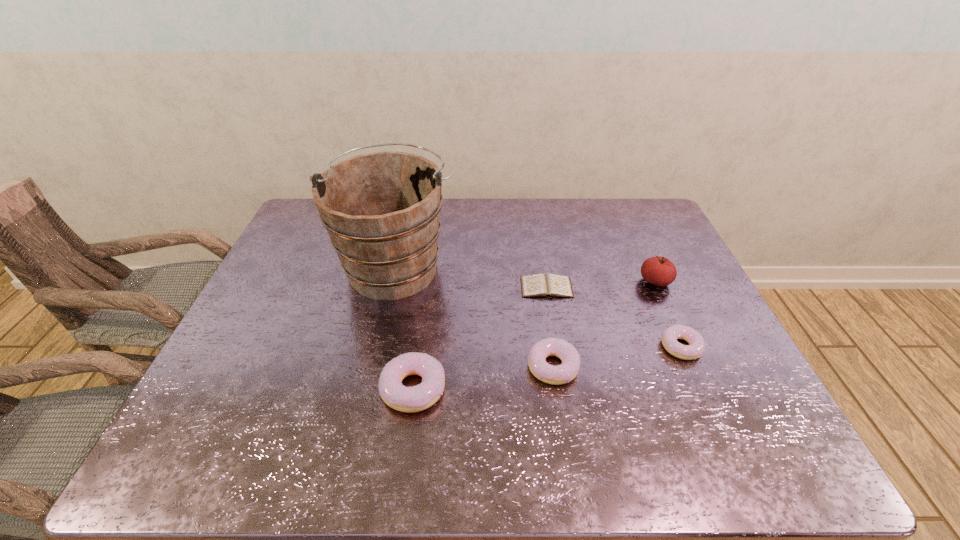
Please point a spot on the left to add another doughnut. Please provide its 2D coordinates. Your answer should be formatted as a tuple, i.e. [(x, y)], where the tuple contains the x and y coordinates of a point satisfying the conditions above.

[(260, 411)]